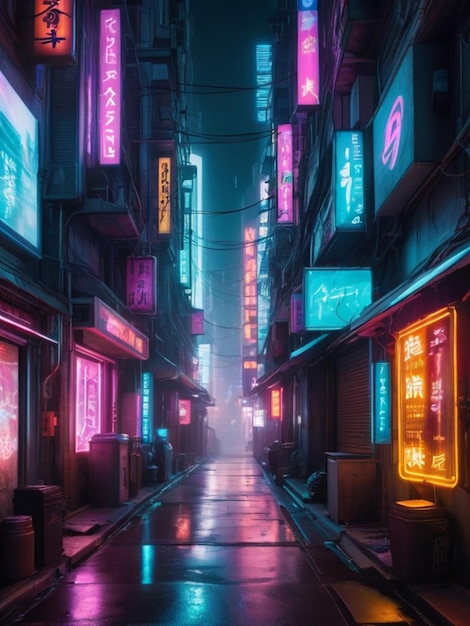
In order to click on trash cans in this screenshot , I will do `click(58, 536)`, `click(111, 457)`, `click(427, 536)`, `click(362, 478)`.